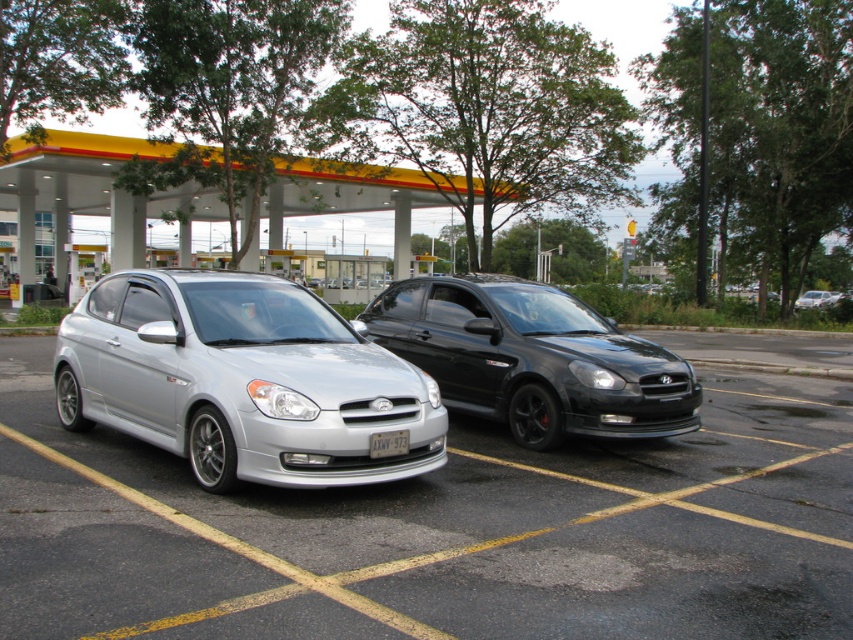
Looking at this image, you are standing at the gas station and want to locate two specific points in the image. The first point is at coordinates point (403, 448), and the second point is at coordinates point (799, 301). Which of these two points is nearer to your current position?

Point (403, 448) is closer to the camera than point (799, 301), so the first point is nearer to your current position.

You are standing at the origin point of the coordinate system where the parking lot is your reference. The silver metallic car at center is at point (x=439, y=531). If you want to walk to the silver metallic car at center, which direction should you move relative to your current position?

To reach the silver metallic car at center located at point (x=439, y=531), you should move in the positive x and positive y direction since both coordinates are greater than zero.